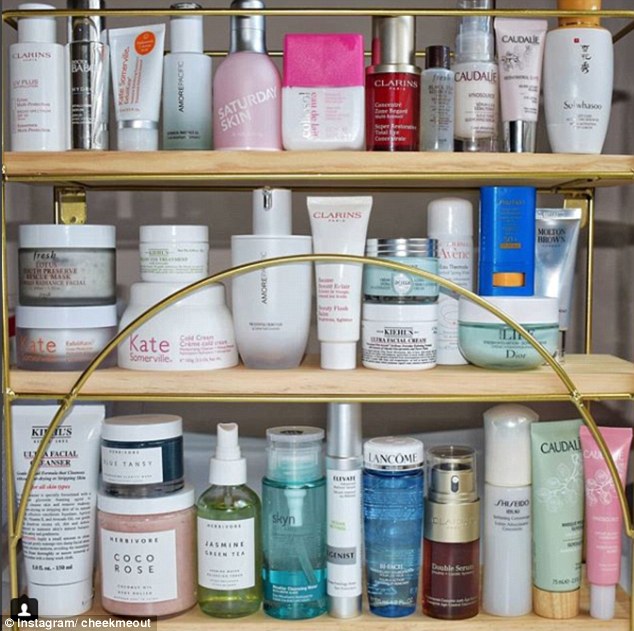
Where is `pink bottle on top shelf, 5th product from the left`? The height and width of the screenshot is (631, 634). pink bottle on top shelf, 5th product from the left is located at coordinates (246, 69).